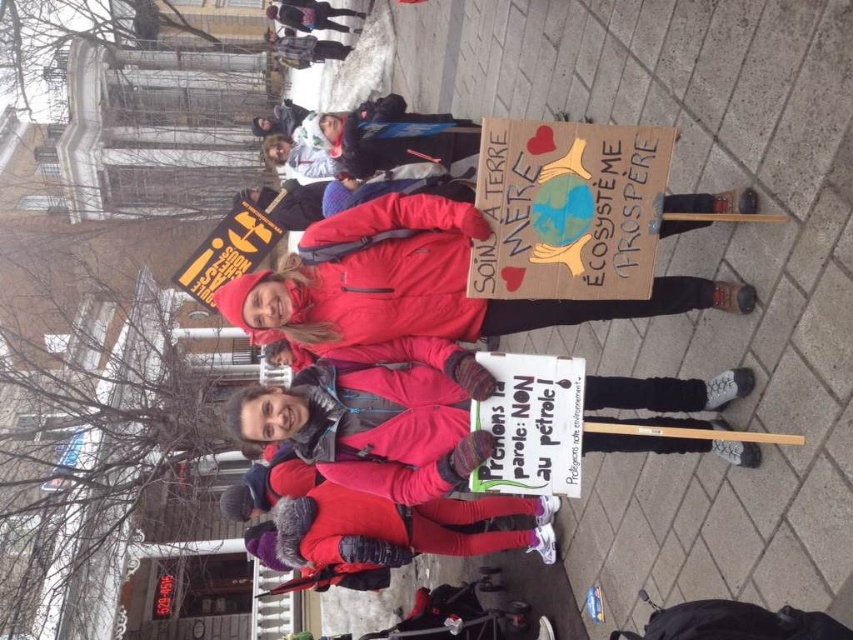
Question: Does black cardboard sign at left have a smaller size compared to matte black backpack at upper center?

Choices:
 (A) no
 (B) yes

Answer: (B)

Question: Is matte red jacket at center in front of black cardboard sign at left?

Choices:
 (A) yes
 (B) no

Answer: (A)

Question: Which point appears farthest from the camera in this image?

Choices:
 (A) (575, 460)
 (B) (299, 13)
 (C) (287, 65)
 (D) (468, 515)

Answer: (C)

Question: Among these objects, which one is nearest to the camera?

Choices:
 (A) matte pink coat at center
 (B) matte red jacket at center
 (C) red knit hat at upper center
 (D) black cardboard sign at left

Answer: (B)

Question: Which object is closer to the camera taking this photo?

Choices:
 (A) matte black backpack at upper center
 (B) cardboard poster at center
 (C) green paper sign at center
 (D) red knit hat at upper center

Answer: (B)

Question: Does matte red jacket at center have a larger size compared to matte pink coat at center?

Choices:
 (A) no
 (B) yes

Answer: (A)